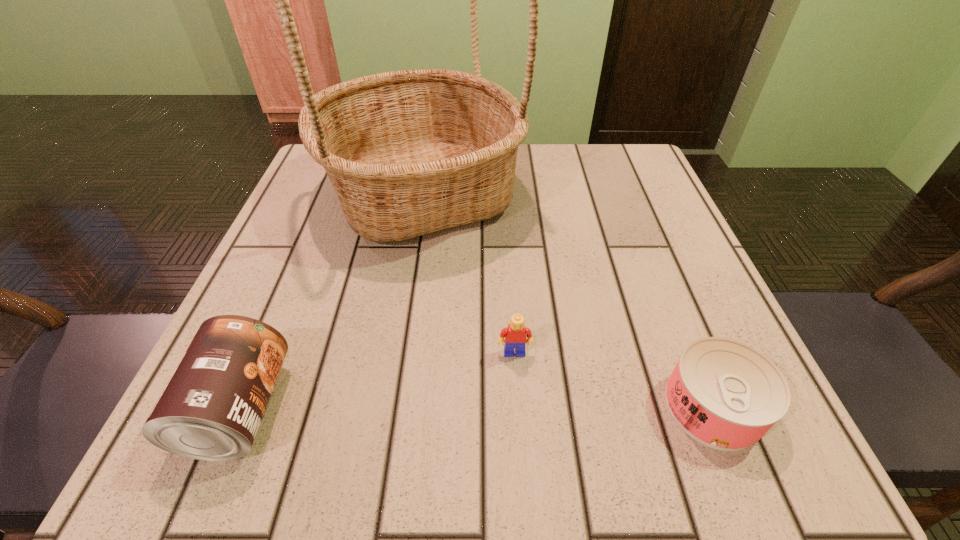
Identify the location of free spot between the third tallest object and the shortest object. Image resolution: width=960 pixels, height=540 pixels. (614, 380).

This screenshot has height=540, width=960. What are the coordinates of `empty location between the basket and the second shortest object` in the screenshot? It's located at (468, 273).

Find the location of a particular element. empty location between the left can and the second farthest object is located at coordinates coord(377,381).

Where is `vacant space that is in between the taller can and the rightmost object`? Image resolution: width=960 pixels, height=540 pixels. vacant space that is in between the taller can and the rightmost object is located at coordinates (476, 408).

Point out which object is positioned as the third nearest to the second shortest object. Please provide its 2D coordinates. Your answer should be formatted as a tuple, i.e. [(x, y)], where the tuple contains the x and y coordinates of a point satisfying the conditions above.

[(211, 409)]

You are a GUI agent. You are given a task and a screenshot of the screen. Output one action in this format:
    pyautogui.click(x=<x>, y=<y>)
    Task: Click on the second closest object relative to the shortest object
    The width and height of the screenshot is (960, 540).
    Given the screenshot: What is the action you would take?
    point(411,152)

The height and width of the screenshot is (540, 960). Identify the location of blank space that satisfies the following two spatial constraints: 1. on the front side of the basket; 2. on the front label of the left can. (386, 409).

I want to click on free space that satisfies the following two spatial constraints: 1. on the front side of the basket; 2. on the front label of the left can, so click(386, 409).

This screenshot has height=540, width=960. Find the location of `vacant region that satisfies the following two spatial constraints: 1. on the face of the third tallest object; 2. on the left side of the rightmost object`. vacant region that satisfies the following two spatial constraints: 1. on the face of the third tallest object; 2. on the left side of the rightmost object is located at coordinates (518, 406).

Locate an element on the screen. This screenshot has height=540, width=960. vacant space that satisfies the following two spatial constraints: 1. on the face of the Lego; 2. on the front label of the left can is located at coordinates (518, 409).